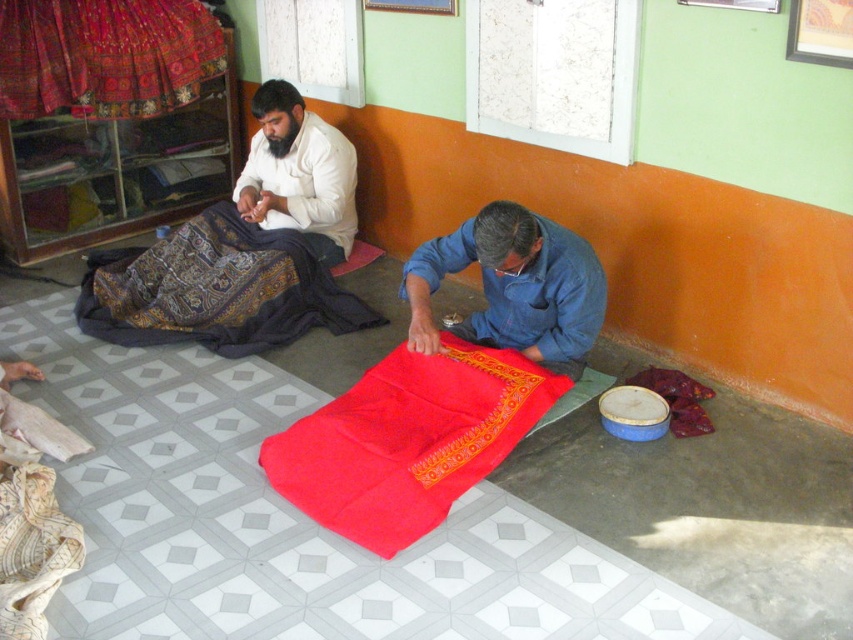
Does embroidered silk cloth at upper left have a larger size compared to denim shirt at lower center?

Yes, embroidered silk cloth at upper left is bigger than denim shirt at lower center.

Is embroidered silk cloth at upper left positioned behind denim shirt at lower center?

Yes, embroidered silk cloth at upper left is behind denim shirt at lower center.

Identify the location of embroidered silk cloth at upper left. (105, 56).

Consider the image. Does matte red fabric at center have a lesser height compared to white cotton shirt at upper left?

Yes, matte red fabric at center is shorter than white cotton shirt at upper left.

Is point (309, 432) farther from camera compared to point (276, 109)?

No, (309, 432) is closer to viewer.

Is point (436, 426) positioned behind point (315, 218)?

No, it is not.

The width and height of the screenshot is (853, 640). In order to click on matte red fabric at center in this screenshot , I will do `click(408, 440)`.

At what (x,y) coordinates should I click in order to perform the action: click on patterned silk cloth at left. Please return your answer as a coordinate pair (x, y). The height and width of the screenshot is (640, 853). Looking at the image, I should click on (216, 289).

Is point (132, 296) in front of point (496, 333)?

No, it is not.

The height and width of the screenshot is (640, 853). I want to click on patterned silk cloth at left, so click(216, 289).